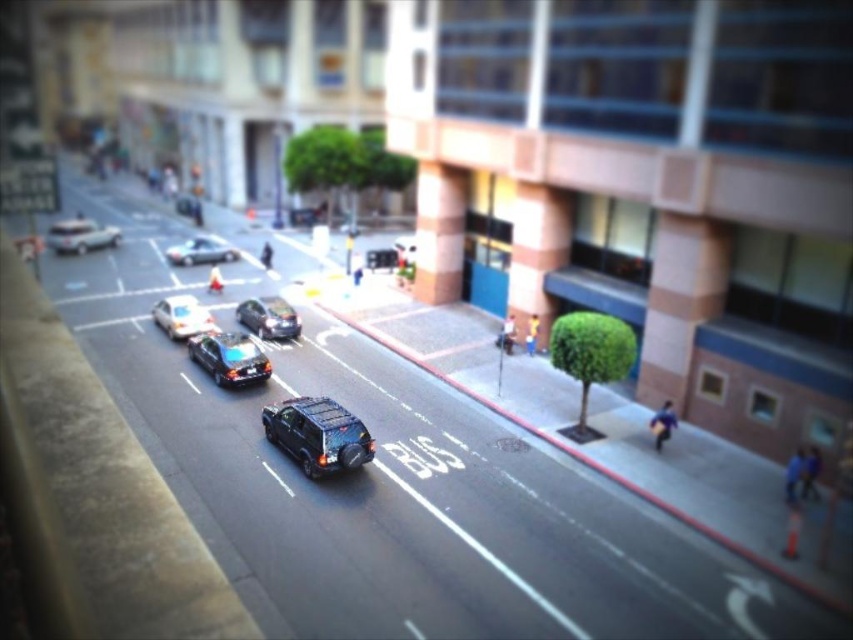
Describe the element at coordinates (268, 317) in the screenshot. The image size is (853, 640). I see `shiny black sedan at center` at that location.

Is point (288, 328) positioned before point (177, 257)?

Yes, it is in front of point (177, 257).

Which is in front, point (273, 296) or point (212, 237)?

Positioned in front is point (273, 296).

Where is `shiny black sedan at center`? This screenshot has width=853, height=640. shiny black sedan at center is located at coordinates (268, 317).

Is shiny black sedan at center above shiny silver taxi at center?

Indeed, shiny black sedan at center is positioned over shiny silver taxi at center.

Can you confirm if shiny black sedan at center is positioned to the left of shiny silver taxi at center?

No, shiny black sedan at center is not to the left of shiny silver taxi at center.

The width and height of the screenshot is (853, 640). What are the coordinates of `shiny black sedan at center` in the screenshot? It's located at (268, 317).

Does matte black suv at center come in front of shiny black sedan at center?

Yes, matte black suv at center is closer to the viewer.

Between point (366, 442) and point (283, 307), which one is positioned in front?

Point (366, 442)

The width and height of the screenshot is (853, 640). I want to click on matte black suv at center, so click(x=317, y=435).